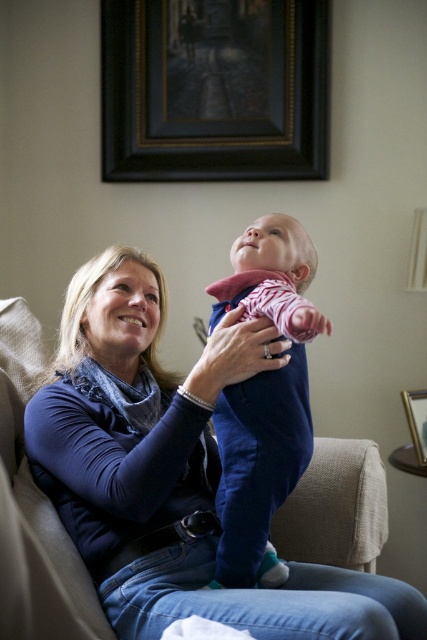
In the scene shown: Can you confirm if black wood picture frame at upper center is positioned above wooden picture frame at upper right?

Correct, black wood picture frame at upper center is located above wooden picture frame at upper right.

Does black wood picture frame at upper center have a lesser height compared to wooden picture frame at upper right?

In fact, black wood picture frame at upper center may be taller than wooden picture frame at upper right.

Where is `black wood picture frame at upper center`? The height and width of the screenshot is (640, 427). black wood picture frame at upper center is located at coordinates (213, 90).

Find the location of a particular element. The width and height of the screenshot is (427, 640). blue fleece sweater at upper left is located at coordinates (172, 470).

Does blue fleece sweater at upper left lie behind wooden picture frame at upper right?

No.

Does point (377, 612) lie in front of point (424, 428)?

Yes, point (377, 612) is in front of point (424, 428).

Find the location of a particular element. blue fleece sweater at upper left is located at coordinates click(172, 470).

Is blue fleece sweater at upper left wider than black wood picture frame at upper center?

Indeed, blue fleece sweater at upper left has a greater width compared to black wood picture frame at upper center.

In the scene shown: Is blue fleece sweater at upper left positioned at the back of black wood picture frame at upper center?

No, blue fleece sweater at upper left is closer to the viewer.

Does point (173, 538) come closer to viewer compared to point (149, 88)?

Yes, it is in front of point (149, 88).

You are a GUI agent. You are given a task and a screenshot of the screen. Output one action in this format:
    pyautogui.click(x=<x>, y=<y>)
    Task: Click on the blue fleece sweater at upper left
    
    Given the screenshot: What is the action you would take?
    pyautogui.click(x=172, y=470)